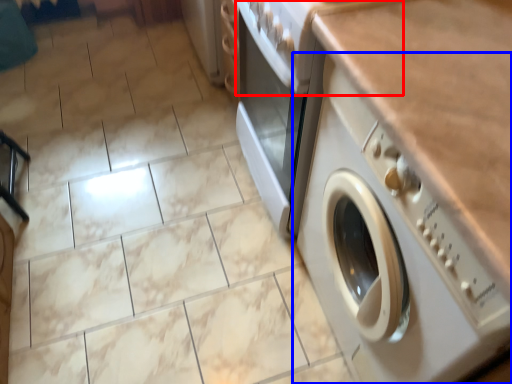
Question: Which object appears farthest to the camera in this image, gas stove (highlighted by a red box) or washing machine (highlighted by a blue box)?

Choices:
 (A) gas stove
 (B) washing machine

Answer: (A)